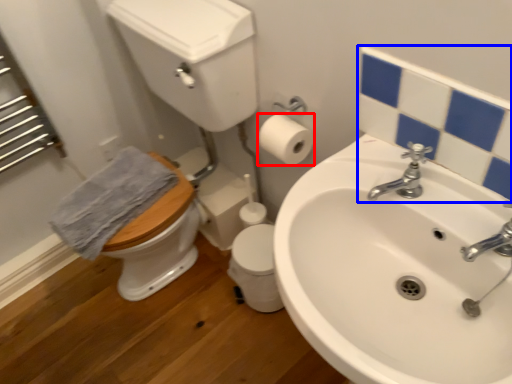
Question: Among these objects, which one is nearest to the camera, toilet paper (highlighted by a red box) or mirror (highlighted by a blue box)?

Choices:
 (A) toilet paper
 (B) mirror

Answer: (B)